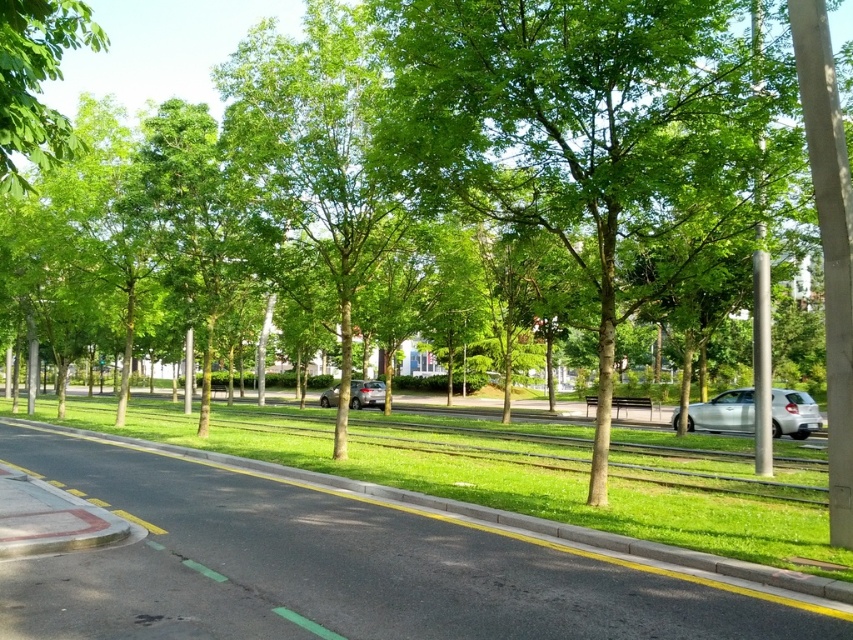
Between green leafy tree at upper left and silver metallic car at right, which one is positioned higher?

green leafy tree at upper left

Is green leafy tree at upper left positioned before silver metallic car at right?

That is True.

Find the location of a particular element. This screenshot has height=640, width=853. green leafy tree at upper left is located at coordinates (36, 81).

Does point (599, 577) lie behind point (802, 422)?

No.

In the scene shown: Between black asphalt pavement at center and silver metallic car at right, which one has more height?

Standing taller between the two is silver metallic car at right.

Which is in front, point (439, 541) or point (793, 438)?

Positioned in front is point (439, 541).

Identify the location of black asphalt pavement at center. The height and width of the screenshot is (640, 853). (341, 568).

Which is more to the right, silver metallic car at right or satin silver sedan at center?

Positioned to the right is silver metallic car at right.

Which is above, silver metallic car at right or satin silver sedan at center?

silver metallic car at right

Does point (709, 404) come farther from viewer compared to point (328, 388)?

No, (709, 404) is closer to viewer.

Locate an element on the screen. The width and height of the screenshot is (853, 640). silver metallic car at right is located at coordinates (723, 412).